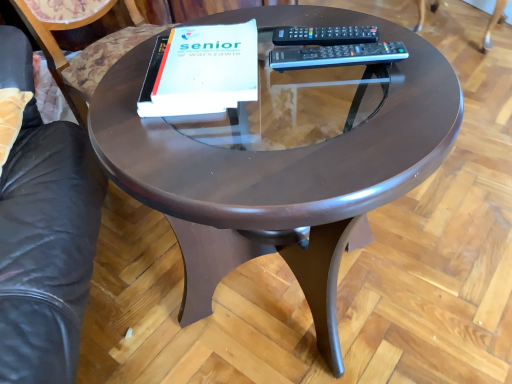
Find the location of a particular element. vacant region under wooden swivel chair at upper right (from a real-world perspective) is located at coordinates (455, 28).